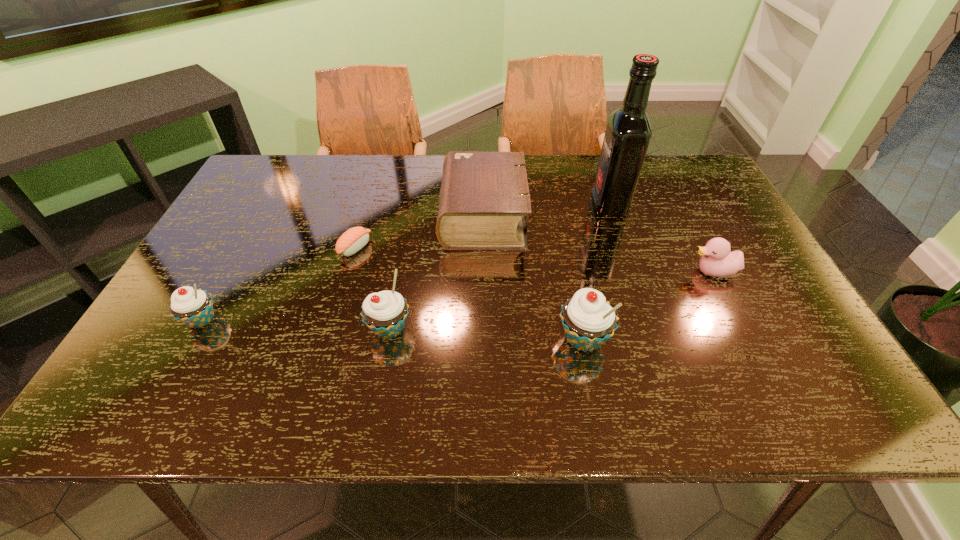
Locate an element on the screen. The image size is (960, 540). free location that satisfies the following two spatial constraints: 1. on the front side of the fifth object from right to left; 2. on the right side of the leftmost cupcake is located at coordinates (197, 329).

Where is `vacant point that satisfies the following two spatial constraints: 1. on the spine side of the Bible; 2. on the front side of the second cupcake from left to right`? The image size is (960, 540). vacant point that satisfies the following two spatial constraints: 1. on the spine side of the Bible; 2. on the front side of the second cupcake from left to right is located at coordinates (484, 329).